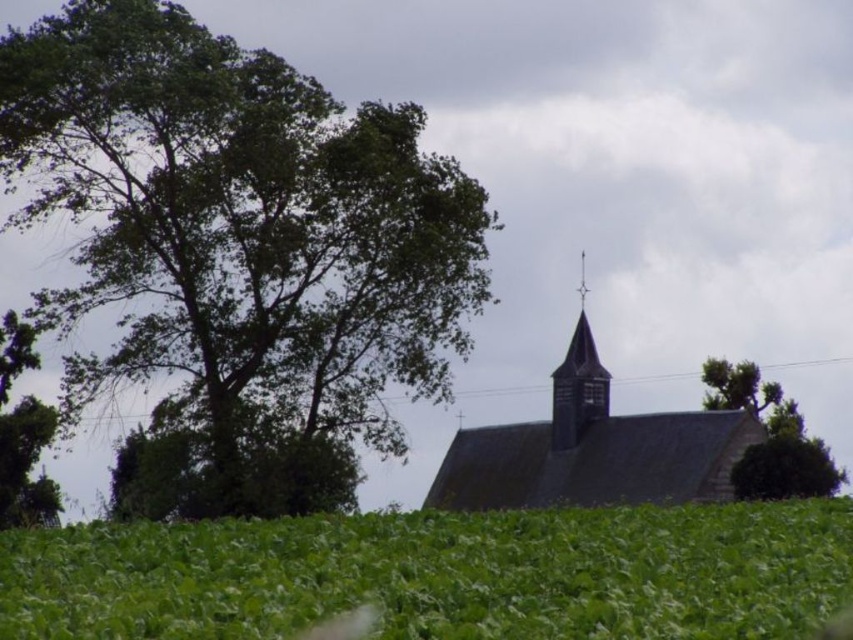
Question: Is green leafy field at lower center to the right of green leafy tree at upper right from the viewer's perspective?

Choices:
 (A) yes
 (B) no

Answer: (B)

Question: Among these objects, which one is farthest from the camera?

Choices:
 (A) green leafy tree at left
 (B) dark gray shingles at center

Answer: (B)

Question: Does green leafy tree at upper left appear on the left side of green leafy tree at left?

Choices:
 (A) no
 (B) yes

Answer: (A)

Question: Observing the image, what is the correct spatial positioning of green leafy field at lower center in reference to smooth dark brown spire at center?

Choices:
 (A) right
 (B) left

Answer: (B)

Question: Which point appears farthest from the camera in this image?

Choices:
 (A) (743, 362)
 (B) (561, 420)

Answer: (A)

Question: Estimate the real-world distances between objects in this image. Which object is closer to the green leafy field at lower center?

Choices:
 (A) smooth dark brown spire at center
 (B) dark gray shingles at center
 (C) green leafy tree at left

Answer: (B)